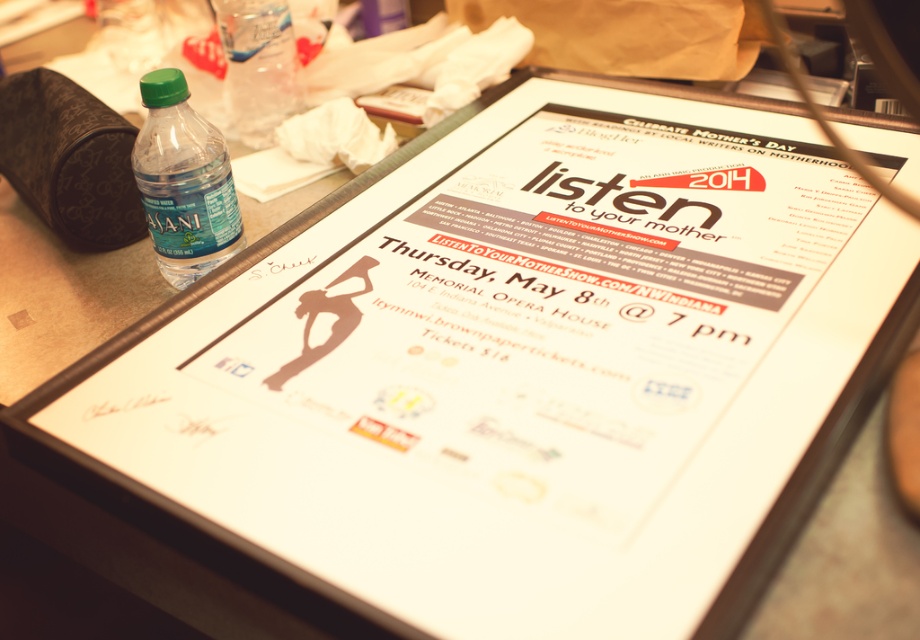
You are organizing a Mother Day event and see the framed poster on the desk with the green matte plastic bottle at left and the translucent plastic bottle at upper left. Which bottle is closer to you?

The green matte plastic bottle at left is closer to you because it is in front of the translucent plastic bottle at upper left.

In the scene shown: You are organizing a Motherhood event and see the framed poster on the desk with the green matte plastic bottle at left and the translucent plastic bottle at upper left. Which bottle is positioned more to the left?

The translucent plastic bottle at upper left is positioned more to the left than the green matte plastic bottle at left.